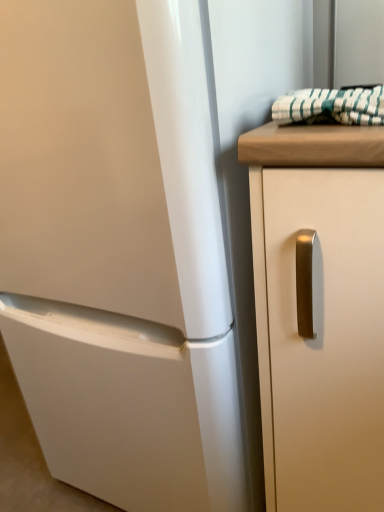
In order to face white matte cabinet handle at right, should I rotate leftwards or rightwards?

You should rotate right by 20.188 degrees.

Image resolution: width=384 pixels, height=512 pixels. Identify the location of white matte cabinet handle at right. (263, 224).

The width and height of the screenshot is (384, 512). What do you see at coordinates (263, 224) in the screenshot?
I see `white matte cabinet handle at right` at bounding box center [263, 224].

This screenshot has width=384, height=512. What are the coordinates of `green striped fabric at upper right` in the screenshot? It's located at (331, 106).

The width and height of the screenshot is (384, 512). What do you see at coordinates (331, 106) in the screenshot?
I see `green striped fabric at upper right` at bounding box center [331, 106].

Locate an element on the screen. This screenshot has height=512, width=384. white matte cabinet handle at right is located at coordinates (263, 224).

Visually, is green striped fabric at upper right positioned to the left or to the right of white matte cabinet handle at right?

green striped fabric at upper right is to the left of white matte cabinet handle at right.

Is green striped fabric at upper right positioned behind white matte cabinet handle at right?

Yes, green striped fabric at upper right is further from the camera.

Does point (313, 103) come closer to viewer compared to point (255, 150)?

No.

From the image's perspective, is green striped fabric at upper right above white matte cabinet handle at right?

Yes.

From a real-world perspective, which is physically above, green striped fabric at upper right or white matte cabinet handle at right?

green striped fabric at upper right.

Which object is wider, green striped fabric at upper right or white matte cabinet handle at right?

white matte cabinet handle at right is wider.

Considering the relative sizes of green striped fabric at upper right and white matte cabinet handle at right in the image provided, is green striped fabric at upper right shorter than white matte cabinet handle at right?

Correct, green striped fabric at upper right is not as tall as white matte cabinet handle at right.

Does green striped fabric at upper right have a larger size compared to white matte cabinet handle at right?

No, green striped fabric at upper right is not bigger than white matte cabinet handle at right.

Do you think green striped fabric at upper right is within white matte cabinet handle at right, or outside of it?

green striped fabric at upper right is outside white matte cabinet handle at right.

Is green striped fabric at upper right with white matte cabinet handle at right?

No, green striped fabric at upper right is not next to white matte cabinet handle at right.

Does green striped fabric at upper right turn towards white matte cabinet handle at right?

No, green striped fabric at upper right is not aimed at white matte cabinet handle at right.

In the scene shown: How many degrees apart are the facing directions of green striped fabric at upper right and white matte cabinet handle at right?

There is a 4.45-degree angle between the facing directions of green striped fabric at upper right and white matte cabinet handle at right.

Where is `blanket positioned vertically above the white matte cabinet handle at right (from a real-world perspective)`? The height and width of the screenshot is (512, 384). blanket positioned vertically above the white matte cabinet handle at right (from a real-world perspective) is located at coordinates (331, 106).

Does white matte cabinet handle at right appear on the right side of green striped fabric at upper right?

Correct, you'll find white matte cabinet handle at right to the right of green striped fabric at upper right.

Considering the positions of objects white matte cabinet handle at right and green striped fabric at upper right in the image provided, who is behind, white matte cabinet handle at right or green striped fabric at upper right?

green striped fabric at upper right.

Which is behind, point (297, 163) or point (325, 91)?

The point (325, 91) is farther.

From the image's perspective, does white matte cabinet handle at right appear higher than green striped fabric at upper right?

Incorrect, from the image's perspective, white matte cabinet handle at right is lower than green striped fabric at upper right.

From a real-world perspective, is white matte cabinet handle at right physically located above or below green striped fabric at upper right?

white matte cabinet handle at right is below green striped fabric at upper right.

Is white matte cabinet handle at right thinner than green striped fabric at upper right?

In fact, white matte cabinet handle at right might be wider than green striped fabric at upper right.

Considering the sizes of objects white matte cabinet handle at right and green striped fabric at upper right in the image provided, who is taller, white matte cabinet handle at right or green striped fabric at upper right?

Standing taller between the two is white matte cabinet handle at right.

Which of these two, white matte cabinet handle at right or green striped fabric at upper right, is smaller?

With smaller size is green striped fabric at upper right.

Is green striped fabric at upper right a part of white matte cabinet handle at right?

Actually, green striped fabric at upper right is outside white matte cabinet handle at right.

Is white matte cabinet handle at right placed right next to green striped fabric at upper right?

white matte cabinet handle at right and green striped fabric at upper right are not in contact.

Consider the image. Could you tell me if white matte cabinet handle at right is turned towards green striped fabric at upper right?

No, white matte cabinet handle at right is not aimed at green striped fabric at upper right.

You are a GUI agent. You are given a task and a screenshot of the screen. Output one action in this format:
    pyautogui.click(x=<x>, y=<y>)
    Task: Click on the cabinetry that is on the right side of green striped fabric at upper right
    
    Given the screenshot: What is the action you would take?
    pyautogui.click(x=263, y=224)

At what (x,y) coordinates should I click in order to perform the action: click on cabinetry in front of the green striped fabric at upper right. Please return your answer as a coordinate pair (x, y). Looking at the image, I should click on (263, 224).

Identify the location of cabinetry on the right of green striped fabric at upper right. coord(263,224).